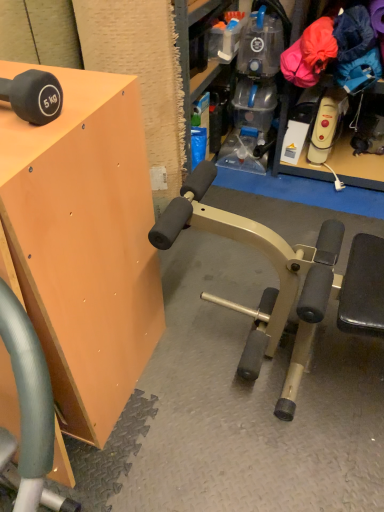
Question: Looking at their shapes, would you say matte orange cabinet at upper left is wider or thinner than matte black dumbbell at upper left?

Choices:
 (A) wide
 (B) thin

Answer: (A)

Question: Considering their positions, is matte orange cabinet at upper left located in front of or behind matte black dumbbell at upper left?

Choices:
 (A) behind
 (B) front

Answer: (B)

Question: Considering the relative positions of matte orange cabinet at upper left and matte black dumbbell at upper left in the image provided, is matte orange cabinet at upper left to the left or to the right of matte black dumbbell at upper left?

Choices:
 (A) left
 (B) right

Answer: (A)

Question: From the image's perspective, is matte black dumbbell at upper left above or below matte orange cabinet at upper left?

Choices:
 (A) below
 (B) above

Answer: (B)

Question: In the image, is matte black dumbbell at upper left on the left side or the right side of matte orange cabinet at upper left?

Choices:
 (A) left
 (B) right

Answer: (B)

Question: From their relative heights in the image, would you say matte black dumbbell at upper left is taller or shorter than matte orange cabinet at upper left?

Choices:
 (A) short
 (B) tall

Answer: (A)

Question: Is matte black dumbbell at upper left wider or thinner than matte orange cabinet at upper left?

Choices:
 (A) wide
 (B) thin

Answer: (B)